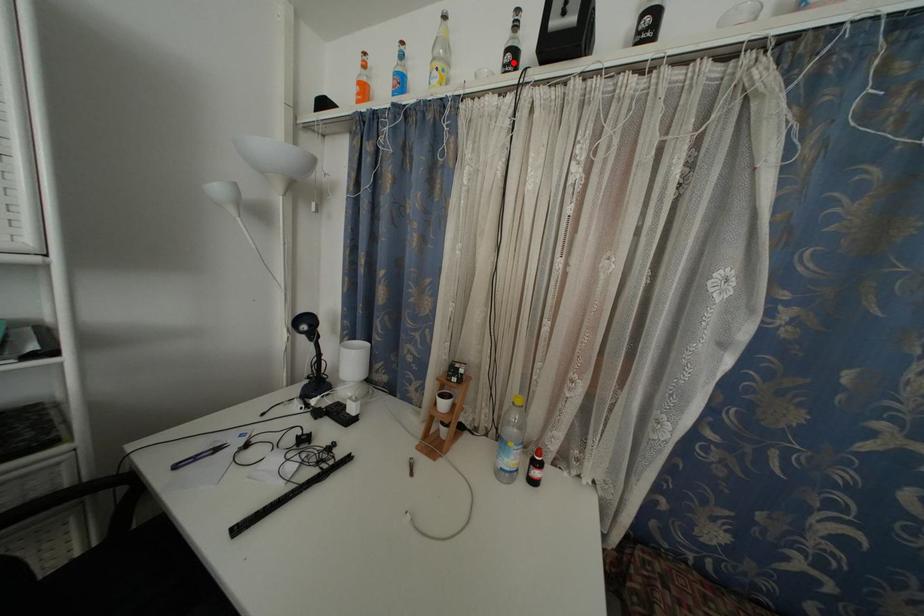
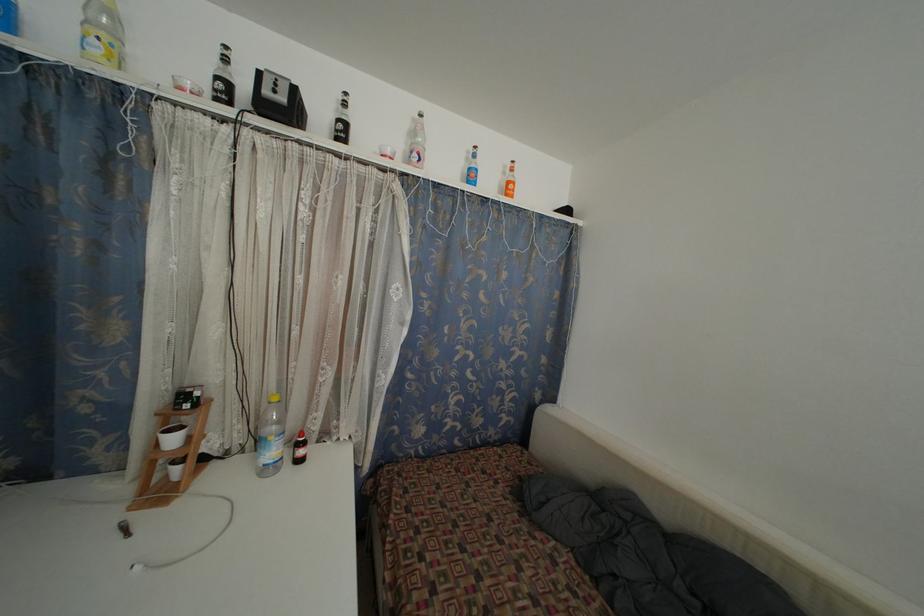
In the second image, find the point that corresponds to the highlighted location in the first image.

(225, 91)